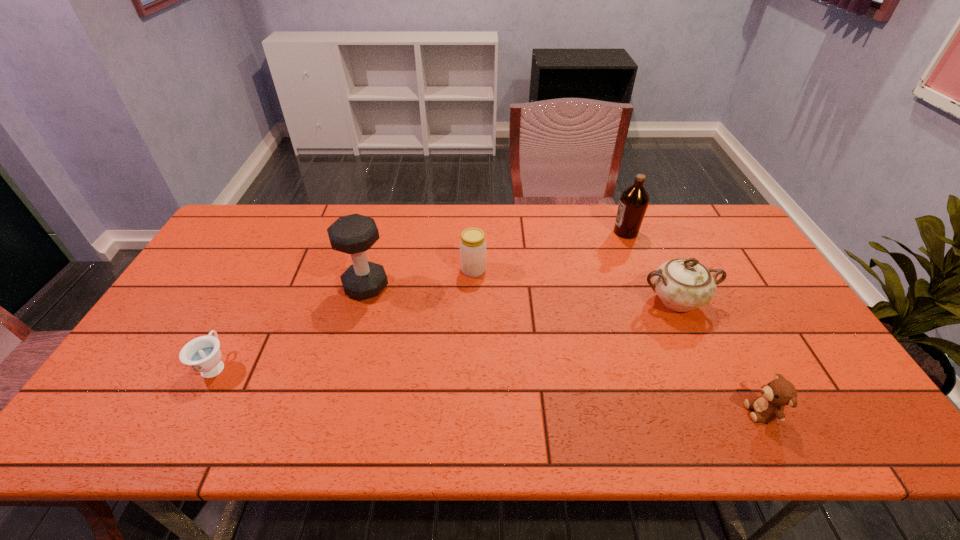
Find the location of `vacant space located on the side of the teacup with the handle`. vacant space located on the side of the teacup with the handle is located at coordinates (234, 329).

At what (x,y) coordinates should I click in order to perform the action: click on object that is at the far edge. Please return your answer as a coordinate pair (x, y). Image resolution: width=960 pixels, height=540 pixels. Looking at the image, I should click on (634, 200).

Where is `object present at the near edge`? object present at the near edge is located at coordinates (768, 407).

In the image, there is a desktop. Where is `vacant space at the far edge`? The image size is (960, 540). vacant space at the far edge is located at coordinates [x=483, y=208].

The width and height of the screenshot is (960, 540). What are the coordinates of `vacant space at the near edge of the desktop` in the screenshot? It's located at (393, 435).

Where is `free space at the right edge`? free space at the right edge is located at coordinates (853, 405).

Locate an element on the screen. vacant space at the far left corner is located at coordinates (244, 231).

I want to click on free region at the far right corner of the desktop, so click(680, 208).

I want to click on free space between the second nearest object and the olive oil, so click(420, 299).

Locate an element on the screen. This screenshot has height=540, width=960. free area in between the third shortest object and the fifth object from right to left is located at coordinates (420, 278).